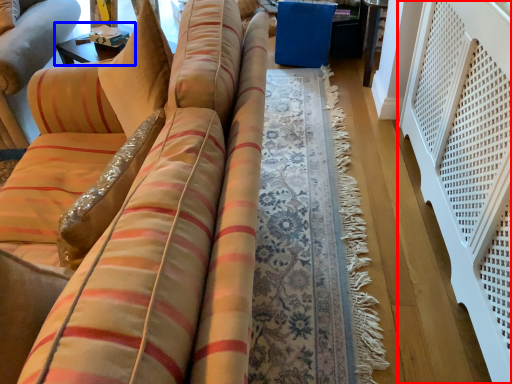
Question: Among these objects, which one is nearest to the camera, balustrade (highlighted by a red box) or table (highlighted by a blue box)?

Choices:
 (A) balustrade
 (B) table

Answer: (A)